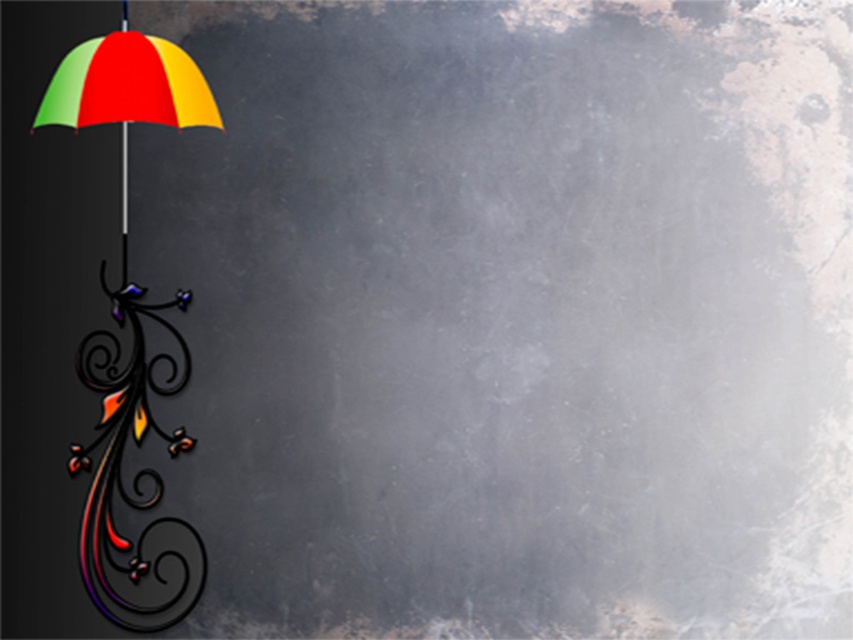
Question: Observing the image, what is the correct spatial positioning of metallic swirl at left in reference to multicolored glossy umbrella at left?

Choices:
 (A) below
 (B) above

Answer: (A)

Question: Is metallic swirl at left smaller than metallic pole at left?

Choices:
 (A) yes
 (B) no

Answer: (B)

Question: Which object is closer to the camera taking this photo?

Choices:
 (A) multicolored glossy umbrella at left
 (B) metallic swirl at left
 (C) metallic pole at left

Answer: (A)

Question: Which of the following is the farthest from the observer?

Choices:
 (A) (181, 387)
 (B) (122, 221)

Answer: (B)

Question: Is metallic swirl at left wider than multicolored glossy umbrella at left?

Choices:
 (A) no
 (B) yes

Answer: (A)

Question: Which point is farther to the camera?

Choices:
 (A) metallic pole at left
 (B) multicolored glossy umbrella at left

Answer: (A)